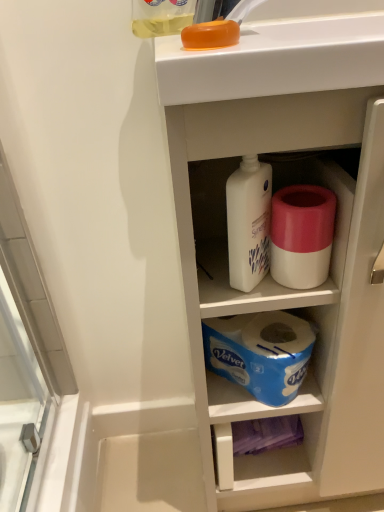
What do you see at coordinates (302, 234) in the screenshot?
I see `white matte toilet paper at center` at bounding box center [302, 234].

I want to click on translucent yellow liquid at upper center, so click(x=161, y=17).

The height and width of the screenshot is (512, 384). What do you see at coordinates (289, 290) in the screenshot? I see `white plastic cabinet at upper center` at bounding box center [289, 290].

Locate an element on the screen. The height and width of the screenshot is (512, 384). white matte toilet paper at center is located at coordinates (302, 234).

Considering their positions, is white plastic cabinet at upper center located in front of or behind white matte toilet paper at center?

Visually, white plastic cabinet at upper center is located in front of white matte toilet paper at center.

Between white plastic cabinet at upper center and white matte toilet paper at center, which one appears on the right side from the viewer's perspective?

white plastic cabinet at upper center is more to the right.

From a real-world perspective, who is located lower, white plastic cabinet at upper center or white matte toilet paper at center?

white plastic cabinet at upper center.

Can you confirm if white plastic cabinet at upper center is smaller than white matte toilet paper at center?

Actually, white plastic cabinet at upper center might be larger than white matte toilet paper at center.

In terms of width, does white matte toilet paper at center look wider or thinner when compared to white plastic cabinet at upper center?

Clearly, white matte toilet paper at center has less width compared to white plastic cabinet at upper center.

Is the surface of white matte toilet paper at center in direct contact with white plastic cabinet at upper center?

No, white matte toilet paper at center is not next to white plastic cabinet at upper center.

Considering their positions, is white matte toilet paper at center located in front of or behind white plastic cabinet at upper center?

white matte toilet paper at center is behind white plastic cabinet at upper center.

Is white matte toilet paper at center shorter than white plastic cabinet at upper center?

Yes.

Visually, is white plastic cabinet at upper center positioned to the left or to the right of translucent yellow liquid at upper center?

white plastic cabinet at upper center is to the right of translucent yellow liquid at upper center.

Image resolution: width=384 pixels, height=512 pixels. In order to click on cabinetry below the translucent yellow liquid at upper center (from the image's perspective) in this screenshot , I will do `click(289, 290)`.

Would you consider white matte toilet paper at center to be distant from translucent yellow liquid at upper center?

white matte toilet paper at center is actually quite close to translucent yellow liquid at upper center.

Which is further, (321, 250) or (165, 17)?

The point (165, 17) is behind.

From the image's perspective, is white matte toilet paper at center positioned above or below translucent yellow liquid at upper center?

From the image's perspective, white matte toilet paper at center appears below translucent yellow liquid at upper center.

Is point (154, 31) positioned before point (281, 196)?

No, (154, 31) is behind (281, 196).

Considering the relative sizes of translucent yellow liquid at upper center and white matte toilet paper at center in the image provided, is translucent yellow liquid at upper center thinner than white matte toilet paper at center?

No.

Does translucent yellow liquid at upper center turn towards white matte toilet paper at center?

No, translucent yellow liquid at upper center is not aimed at white matte toilet paper at center.

Is the depth of translucent yellow liquid at upper center greater than that of white matte toilet paper at center?

No, translucent yellow liquid at upper center is in front of white matte toilet paper at center.

Is translucent yellow liquid at upper center bigger than white plastic cabinet at upper center?

Actually, translucent yellow liquid at upper center might be smaller than white plastic cabinet at upper center.

From a real-world perspective, which is physically above, translucent yellow liquid at upper center or white plastic cabinet at upper center?

In real-world perspective, translucent yellow liquid at upper center is above.

Is translucent yellow liquid at upper center aimed at white plastic cabinet at upper center?

No, translucent yellow liquid at upper center does not turn towards white plastic cabinet at upper center.

Identify the location of toilet paper behind the white plastic cabinet at upper center. click(302, 234).

The height and width of the screenshot is (512, 384). I want to click on toilet paper located on the left of white plastic cabinet at upper center, so click(302, 234).

Estimate the real-world distances between objects in this image. Which object is further from translucent yellow liquid at upper center, white matte toilet paper at center or white plastic cabinet at upper center?

white plastic cabinet at upper center lies further to translucent yellow liquid at upper center than the other object.

From the image, which object appears to be nearer to translucent yellow liquid at upper center, white plastic cabinet at upper center or white matte toilet paper at center?

Among the two, white matte toilet paper at center is located nearer to translucent yellow liquid at upper center.

Which object lies nearer to the anchor point white matte toilet paper at center, translucent yellow liquid at upper center or white plastic cabinet at upper center?

The object closer to white matte toilet paper at center is white plastic cabinet at upper center.

Considering their positions, is white matte toilet paper at center positioned further to white plastic cabinet at upper center than translucent yellow liquid at upper center?

translucent yellow liquid at upper center is further to white plastic cabinet at upper center.

From the image, which object appears to be farther from white matte toilet paper at center, white plastic cabinet at upper center or translucent yellow liquid at upper center?

The object further to white matte toilet paper at center is translucent yellow liquid at upper center.

Considering their positions, is translucent yellow liquid at upper center positioned closer to white plastic cabinet at upper center than white matte toilet paper at center?

white matte toilet paper at center.

Locate an element on the screen. The height and width of the screenshot is (512, 384). toilet paper between translucent yellow liquid at upper center and white plastic cabinet at upper center from top to bottom is located at coordinates (302, 234).